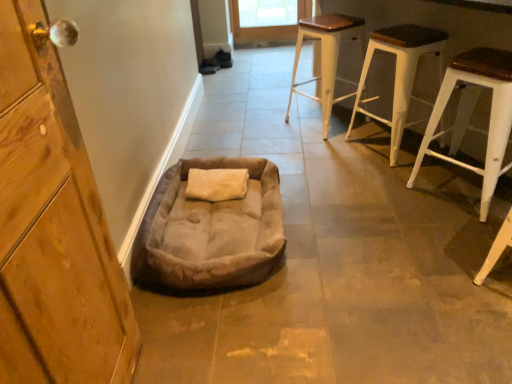
Question: From a real-world perspective, is white wood stool at upper right, which ranks as the 2th stool in right-to-left order, located higher than suede-like beige dog bed at lower center?

Choices:
 (A) no
 (B) yes

Answer: (B)

Question: Does white wood stool at upper right, placed as the 2th stool when sorted from left to right, turn towards suede-like beige dog bed at lower center?

Choices:
 (A) no
 (B) yes

Answer: (A)

Question: Considering the relative sizes of white wood stool at upper right, placed as the 2th stool when sorted from left to right, and suede-like beige dog bed at lower center in the image provided, is white wood stool at upper right, placed as the 2th stool when sorted from left to right, bigger than suede-like beige dog bed at lower center?

Choices:
 (A) yes
 (B) no

Answer: (A)

Question: From a real-world perspective, is white wood stool at upper right, placed as the 2th stool when sorted from left to right, physically below suede-like beige dog bed at lower center?

Choices:
 (A) yes
 (B) no

Answer: (B)

Question: Are white wood stool at upper right, placed as the 2th stool when sorted from left to right, and suede-like beige dog bed at lower center located far from each other?

Choices:
 (A) no
 (B) yes

Answer: (B)

Question: Considering the relative positions of wooden door at left and suede-like beige dog bed at lower center in the image provided, is wooden door at left to the left or to the right of suede-like beige dog bed at lower center?

Choices:
 (A) right
 (B) left

Answer: (B)

Question: Looking at the image, does wooden door at left seem bigger or smaller compared to suede-like beige dog bed at lower center?

Choices:
 (A) small
 (B) big

Answer: (A)

Question: From the image's perspective, is wooden door at left positioned above or below suede-like beige dog bed at lower center?

Choices:
 (A) below
 (B) above

Answer: (A)

Question: In the image, is wooden door at left positioned in front of or behind suede-like beige dog bed at lower center?

Choices:
 (A) behind
 (B) front

Answer: (B)

Question: Is point (358, 82) positioned closer to the camera than point (276, 240)?

Choices:
 (A) farther
 (B) closer

Answer: (A)

Question: Is white wood stool at upper right, placed as the 2th stool when sorted from left to right, situated inside suede-like beige dog bed at lower center or outside?

Choices:
 (A) outside
 (B) inside

Answer: (A)

Question: In terms of height, does white wood stool at upper right, which ranks as the 2th stool in right-to-left order, look taller or shorter compared to suede-like beige dog bed at lower center?

Choices:
 (A) tall
 (B) short

Answer: (A)

Question: From a real-world perspective, is white wood stool at upper right, placed as the 2th stool when sorted from left to right, physically located above or below suede-like beige dog bed at lower center?

Choices:
 (A) above
 (B) below

Answer: (A)

Question: Considering the positions of white wood stool at upper right, placed as the 2th stool when sorted from left to right, and wooden door at left in the image, is white wood stool at upper right, placed as the 2th stool when sorted from left to right, taller or shorter than wooden door at left?

Choices:
 (A) tall
 (B) short

Answer: (B)

Question: From the image's perspective, is white wood stool at upper right, placed as the 2th stool when sorted from left to right, positioned above or below wooden door at left?

Choices:
 (A) below
 (B) above

Answer: (B)